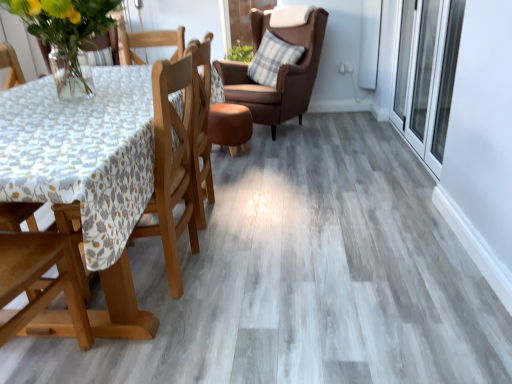
Question: Is brown leather chair at upper center, the 1th chair when ordered from top to bottom, facing towards plaid fabric pillow at upper right?

Choices:
 (A) no
 (B) yes

Answer: (B)

Question: Is plaid fabric pillow at upper right a part of brown leather chair at upper center, arranged as the second chair when ordered from the bottom?

Choices:
 (A) yes
 (B) no

Answer: (A)

Question: Considering the relative sizes of brown leather chair at upper center, the first chair viewed from the back, and plaid fabric pillow at upper right in the image provided, is brown leather chair at upper center, the first chair viewed from the back, thinner than plaid fabric pillow at upper right?

Choices:
 (A) no
 (B) yes

Answer: (A)

Question: Is brown leather chair at upper center, arranged as the second chair when ordered from the bottom, positioned before plaid fabric pillow at upper right?

Choices:
 (A) yes
 (B) no

Answer: (A)

Question: Is brown leather chair at upper center, the 2th chair viewed from the front, outside of plaid fabric pillow at upper right?

Choices:
 (A) no
 (B) yes

Answer: (B)

Question: Considering the relative positions of brown leather chair at upper center, the 1th chair when ordered from top to bottom, and plaid fabric pillow at upper right in the image provided, is brown leather chair at upper center, the 1th chair when ordered from top to bottom, behind plaid fabric pillow at upper right?

Choices:
 (A) yes
 (B) no

Answer: (B)

Question: Is plaid fabric pillow at upper right positioned before wooden chair at left, positioned as the first chair in bottom-to-top order?

Choices:
 (A) no
 (B) yes

Answer: (A)

Question: Can you confirm if plaid fabric pillow at upper right is thinner than wooden chair at left, the second chair positioned from the back?

Choices:
 (A) yes
 (B) no

Answer: (A)

Question: Is wooden chair at left, positioned as the first chair in bottom-to-top order, surrounded by plaid fabric pillow at upper right?

Choices:
 (A) yes
 (B) no

Answer: (B)

Question: Does plaid fabric pillow at upper right appear on the right side of wooden chair at left, positioned as the first chair in bottom-to-top order?

Choices:
 (A) no
 (B) yes

Answer: (B)

Question: From the image's perspective, is plaid fabric pillow at upper right above wooden chair at left, which is the 2th chair from top to bottom?

Choices:
 (A) yes
 (B) no

Answer: (A)

Question: Considering the relative positions of plaid fabric pillow at upper right and wooden chair at left, positioned as the first chair in bottom-to-top order, in the image provided, is plaid fabric pillow at upper right to the left of wooden chair at left, positioned as the first chair in bottom-to-top order, from the viewer's perspective?

Choices:
 (A) yes
 (B) no

Answer: (B)

Question: From the image's perspective, is wooden chair at left, the second chair positioned from the back, under plaid fabric pillow at upper right?

Choices:
 (A) yes
 (B) no

Answer: (A)